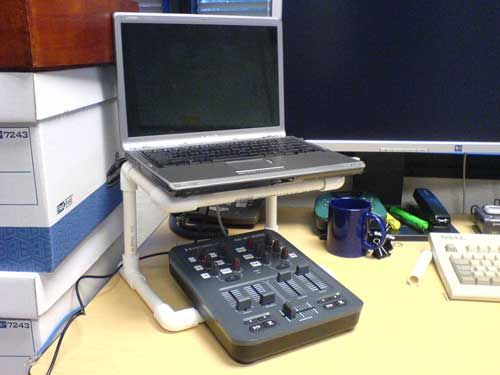
The image size is (500, 375). I want to click on computer screen, so click(x=428, y=67), click(x=217, y=59).